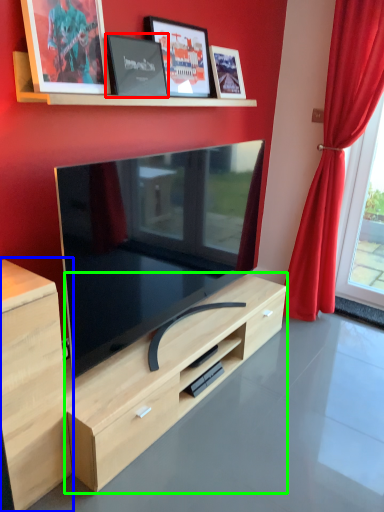
Question: Estimate the real-world distances between objects in this image. Which object is farther from picture frame (highlighted by a red box), cabinetry (highlighted by a blue box) or dresser (highlighted by a green box)?

Choices:
 (A) cabinetry
 (B) dresser

Answer: (B)